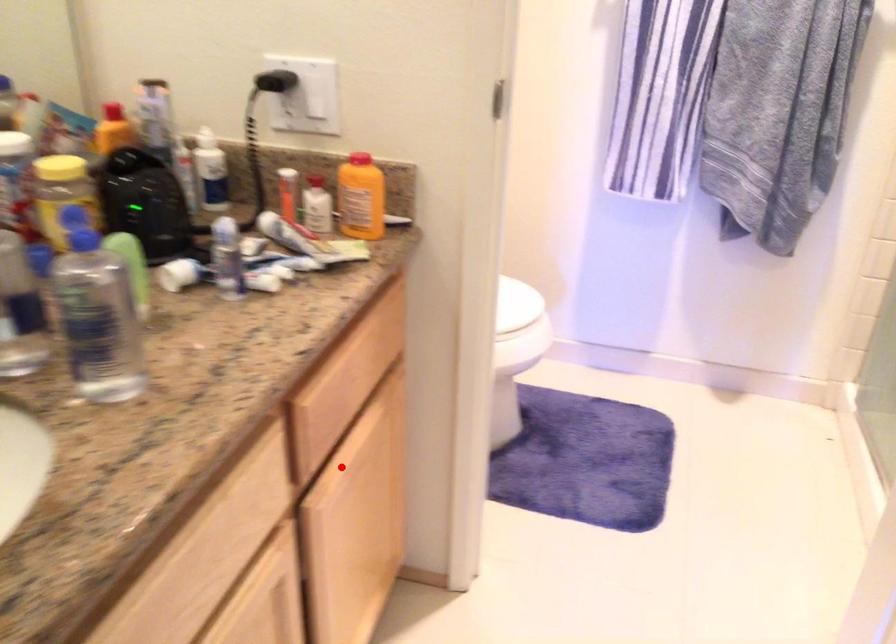
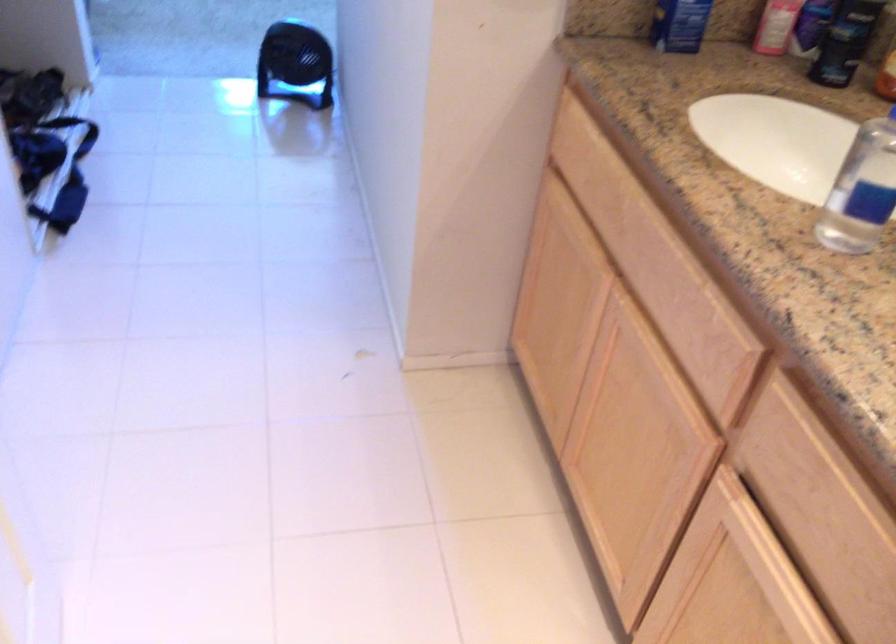
In the second image, find the point that corresponds to the highlighted location in the first image.

(754, 536)